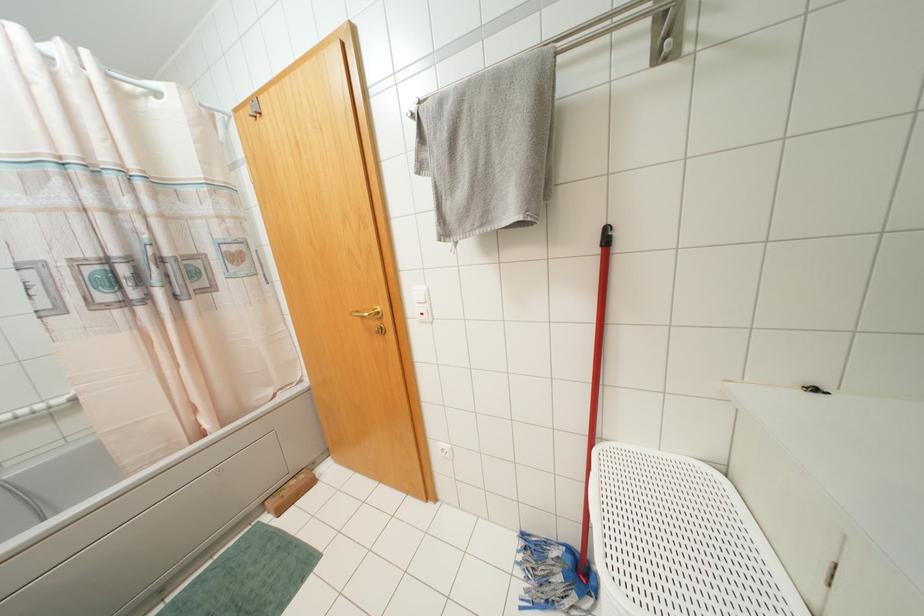
The image size is (924, 616). What do you see at coordinates (368, 313) in the screenshot? I see `the gold door handle` at bounding box center [368, 313].